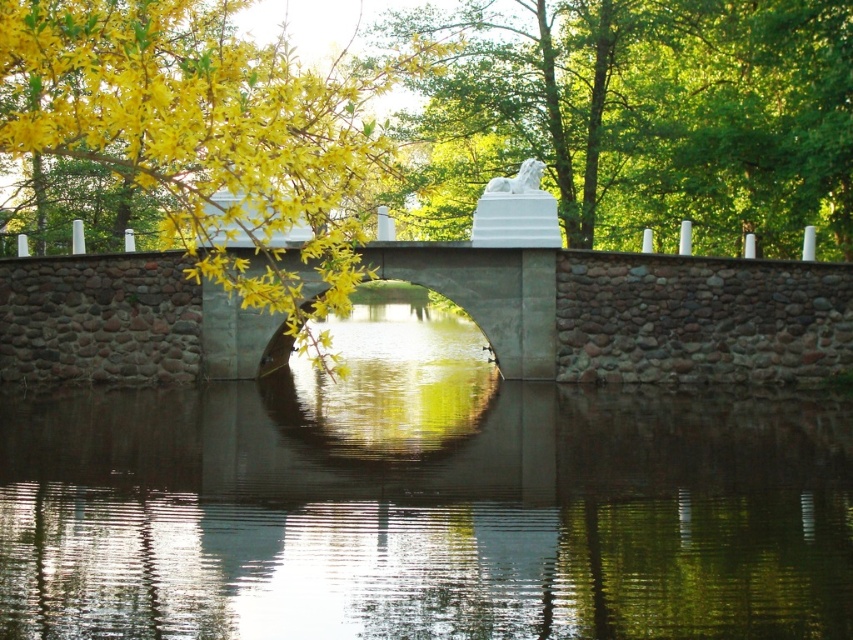
Question: Can you confirm if white stone lion at upper center is positioned to the right of yellow leafy branches at upper left?

Choices:
 (A) yes
 (B) no

Answer: (A)

Question: Is white stone lion at upper center bigger than yellow leafy branches at upper left?

Choices:
 (A) yes
 (B) no

Answer: (B)

Question: Among these objects, which one is nearest to the camera?

Choices:
 (A) yellow leafy branches at upper left
 (B) white stone lion at upper center

Answer: (A)

Question: In this image, where is white stone lion at upper center located relative to yellow leafy branches at upper left?

Choices:
 (A) right
 (B) left

Answer: (A)